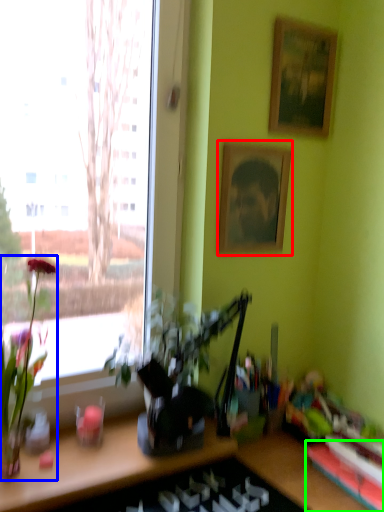
Question: Which object is the farthest from picture frame (highlighted by a red box)? Choose among these: houseplant (highlighted by a blue box) or shelf (highlighted by a green box).

Choices:
 (A) houseplant
 (B) shelf

Answer: (B)